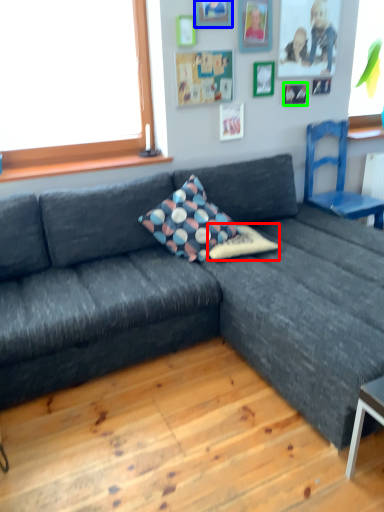
Question: Which is farther away from pillow (highlighted by a red box)? picture frame (highlighted by a blue box) or picture frame (highlighted by a green box)?

Choices:
 (A) picture frame
 (B) picture frame

Answer: (A)